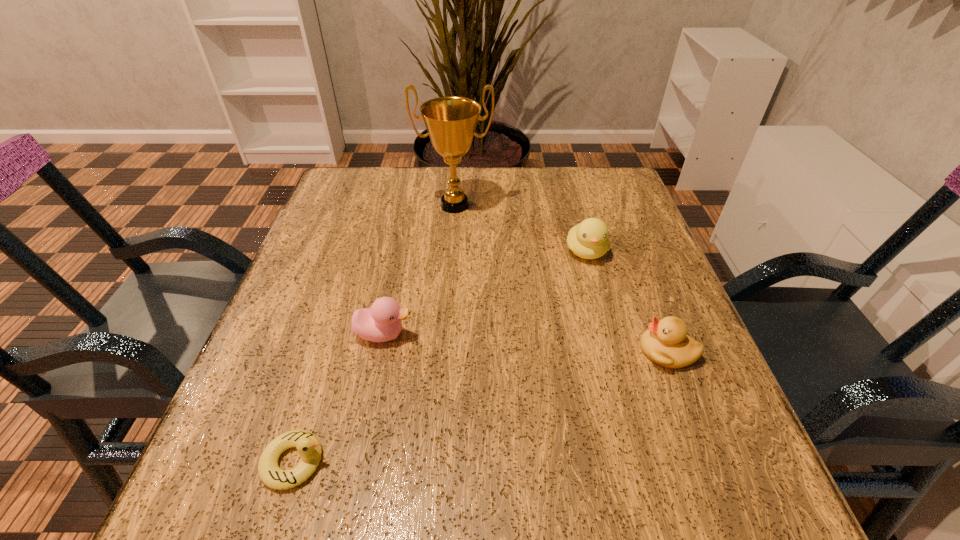
This screenshot has height=540, width=960. What are the coordinates of `vacant space located on the front-facing side of the rightmost duckling` in the screenshot? It's located at (473, 351).

Identify the location of vacant space located 0.170m on the front-facing side of the rightmost duckling. The width and height of the screenshot is (960, 540). (542, 351).

Where is `vacant space located on the front-facing side of the rightmost duckling`? The width and height of the screenshot is (960, 540). vacant space located on the front-facing side of the rightmost duckling is located at coordinates (427, 351).

This screenshot has height=540, width=960. Identify the location of free space located on the face of the shortest duckling. (412, 462).

Image resolution: width=960 pixels, height=540 pixels. I want to click on object that is at the far edge, so click(x=451, y=121).

Image resolution: width=960 pixels, height=540 pixels. Find the location of `object situated at the near edge`. object situated at the near edge is located at coordinates (308, 446).

In order to click on object present at the near left corner in this screenshot , I will do `click(308, 446)`.

This screenshot has width=960, height=540. I want to click on vacant space at the far edge, so pyautogui.click(x=435, y=198).

Where is `free space at the near edge of the desktop`? The image size is (960, 540). free space at the near edge of the desktop is located at coordinates (350, 465).

Where is `free point at the left edge`? Image resolution: width=960 pixels, height=540 pixels. free point at the left edge is located at coordinates (331, 227).